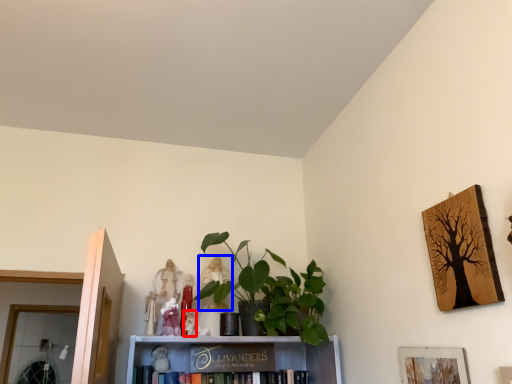
Question: Which object is closer to the camera taking this photo, toy (highlighted by a red box) or toy (highlighted by a blue box)?

Choices:
 (A) toy
 (B) toy

Answer: (A)